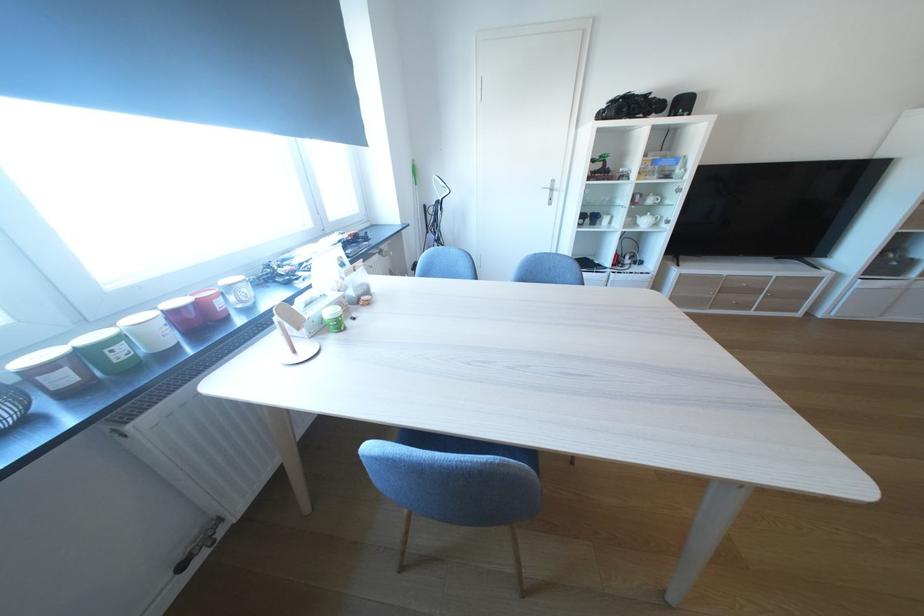
Find where to pull the silver door handle. Please return your answer as a coordinate pair (x, y).

(551, 192)